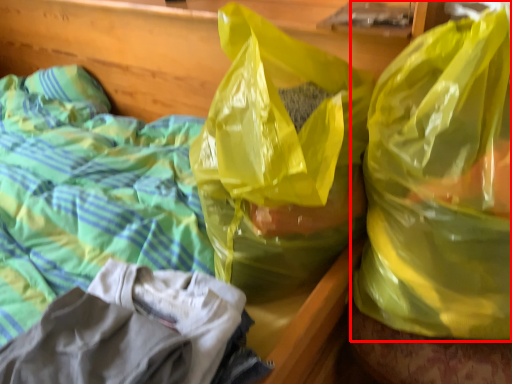
Question: From the image's perspective, what is the correct spatial positioning of plastic bag (annotated by the red box) in reference to plastic bag?

Choices:
 (A) above
 (B) below

Answer: (B)